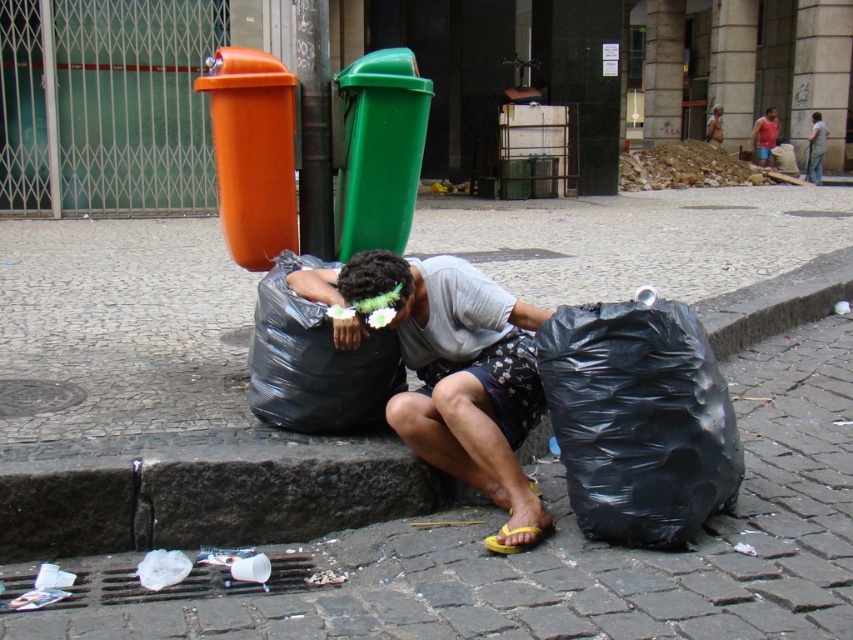
Question: Which object appears farthest from the camera in this image?

Choices:
 (A) black plastic bag at center
 (B) black plastic bag at lower right
 (C) dark gray fabric shirt at center

Answer: (C)

Question: Is black plastic bag at center positioned in front of dark gray fabric shirt at center?

Choices:
 (A) no
 (B) yes

Answer: (B)

Question: Can you confirm if dark gray fabric shirt at center is wider than matte pink shirt at upper right?

Choices:
 (A) no
 (B) yes

Answer: (B)

Question: Estimate the real-world distances between objects in this image. Which object is closer to the gray fabric shirt at center?

Choices:
 (A) cobblestone pavement at center
 (B) matte pink shirt at upper right

Answer: (A)

Question: Which of the following is the farthest from the observer?

Choices:
 (A) cobblestone pavement at center
 (B) black plastic bag at center
 (C) matte pink shirt at upper right

Answer: (C)

Question: Is gray fabric shirt at center above matte pink shirt at upper right?

Choices:
 (A) no
 (B) yes

Answer: (A)